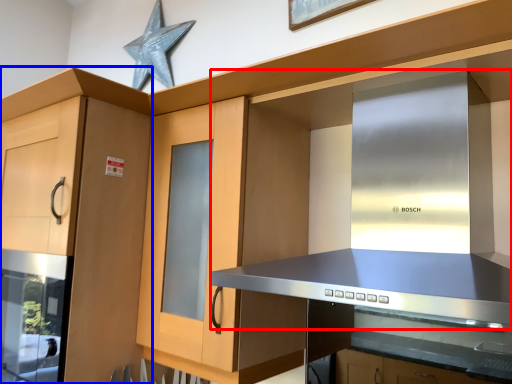
Question: Which object is closer to the camera taking this photo, vent (highlighted by a red box) or cabinetry (highlighted by a blue box)?

Choices:
 (A) vent
 (B) cabinetry

Answer: (A)